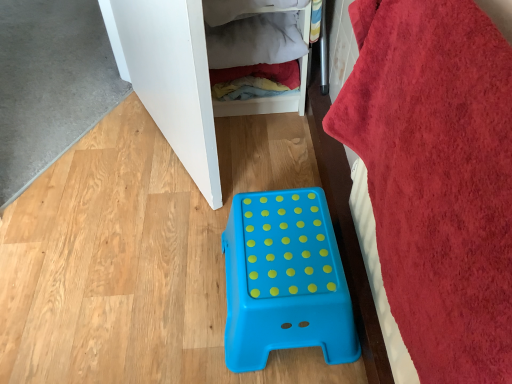
The image size is (512, 384). I want to click on blue plastic step stool at center, the 2th furniture from the left, so click(284, 280).

Describe the element at coordinates (437, 179) in the screenshot. I see `red plush bath towel at right` at that location.

This screenshot has height=384, width=512. What are the coordinates of `wooden/textured clothes at upper center` in the screenshot? It's located at (268, 101).

Where is `bath towel above the wooden/textured clothes at upper center (from a real-world perspective)`? The height and width of the screenshot is (384, 512). bath towel above the wooden/textured clothes at upper center (from a real-world perspective) is located at coordinates (437, 179).

Which of these two, wooden/textured clothes at upper center or red plush bath towel at right, is bigger?

Bigger between the two is red plush bath towel at right.

In the scene shown: From a real-world perspective, which object stands above the other?

red plush bath towel at right.

Is point (287, 99) in front of point (398, 70)?

That is False.

Can you confirm if red plush bath towel at right is bigger than white matte cabinet at upper left, acting as the second furniture starting from the bottom?

No.

Can you confirm if red plush bath towel at right is positioned to the right of white matte cabinet at upper left, acting as the first furniture starting from the top?

Yes.

Measure the distance between red plush bath towel at right and white matte cabinet at upper left, marked as the first furniture in a left-to-right arrangement.

red plush bath towel at right is 23.64 inches away from white matte cabinet at upper left, marked as the first furniture in a left-to-right arrangement.

Which furniture is the 2nd one when counting from the back of the red plush bath towel at right? Please provide its 2D coordinates.

[(180, 80)]

Does white matte cabinet at upper left, acting as the second furniture starting from the bottom, appear on the right side of red plush bath towel at right?

In fact, white matte cabinet at upper left, acting as the second furniture starting from the bottom, is to the left of red plush bath towel at right.

Considering the sizes of objects white matte cabinet at upper left, marked as the first furniture in a left-to-right arrangement, and red plush bath towel at right in the image provided, who is thinner, white matte cabinet at upper left, marked as the first furniture in a left-to-right arrangement, or red plush bath towel at right?

red plush bath towel at right is thinner.

Is white matte cabinet at upper left, marked as the first furniture in a left-to-right arrangement, with red plush bath towel at right?

white matte cabinet at upper left, marked as the first furniture in a left-to-right arrangement, and red plush bath towel at right are clearly separated.

Measure the distance from white matte cabinet at upper left, acting as the first furniture starting from the top, to red plush bath towel at right.

They are 23.64 inches apart.

Based on the photo, does blue plastic step stool at center, the second furniture from the top, turn towards red plush bath towel at right?

No, blue plastic step stool at center, the second furniture from the top, does not turn towards red plush bath towel at right.

In terms of height, does blue plastic step stool at center, the second furniture from the top, look taller or shorter compared to red plush bath towel at right?

blue plastic step stool at center, the second furniture from the top, is shorter than red plush bath towel at right.

From the picture: Looking at the image, does blue plastic step stool at center, the 2th furniture from the left, seem bigger or smaller compared to red plush bath towel at right?

blue plastic step stool at center, the 2th furniture from the left, is smaller than red plush bath towel at right.

Which is more to the left, blue plastic step stool at center, the 1th furniture in the right-to-left sequence, or red plush bath towel at right?

blue plastic step stool at center, the 1th furniture in the right-to-left sequence.

Would you say white matte cabinet at upper left, marked as the first furniture in a left-to-right arrangement, is to the left or to the right of blue plastic step stool at center, the 2th furniture from the left, in the picture?

Based on their positions, white matte cabinet at upper left, marked as the first furniture in a left-to-right arrangement, is located to the left of blue plastic step stool at center, the 2th furniture from the left.

Can you tell me how much white matte cabinet at upper left, acting as the first furniture starting from the top, and blue plastic step stool at center, the 2th furniture from the left, differ in facing direction?

They differ by 23.6 degrees in their facing directions.

Consider the image. Is white matte cabinet at upper left, acting as the first furniture starting from the top, positioned far away from blue plastic step stool at center, the first furniture when ordered from bottom to top?

That's not correct — white matte cabinet at upper left, acting as the first furniture starting from the top, is a little close to blue plastic step stool at center, the first furniture when ordered from bottom to top.

Which point is more forward, [481,90] or [220,113]?

Point [481,90]

Choose the correct answer: Is red plush bath towel at right inside wooden/textured clothes at upper center or outside it?

red plush bath towel at right is spatially situated outside wooden/textured clothes at upper center.

Locate an element on the screen. shelf that is behind the red plush bath towel at right is located at coordinates (268, 101).

Can you confirm if red plush bath towel at right is smaller than wooden/textured clothes at upper center?

No.

Is wooden/textured clothes at upper center oriented towards white matte cabinet at upper left, placed as the second furniture when sorted from right to left?

No, wooden/textured clothes at upper center is not facing towards white matte cabinet at upper left, placed as the second furniture when sorted from right to left.

Which object is thinner, wooden/textured clothes at upper center or white matte cabinet at upper left, placed as the second furniture when sorted from right to left?

white matte cabinet at upper left, placed as the second furniture when sorted from right to left.

Based on the photo, from a real-world perspective, who is located lower, wooden/textured clothes at upper center or white matte cabinet at upper left, acting as the second furniture starting from the bottom?

wooden/textured clothes at upper center.

From the image's perspective, which one is positioned higher, wooden/textured clothes at upper center or white matte cabinet at upper left, acting as the first furniture starting from the top?

wooden/textured clothes at upper center appears higher in the image.

Find the location of a particular element. Image resolution: width=512 pixels, height=384 pixels. shelf that appears behind the red plush bath towel at right is located at coordinates (268, 101).

Identify the location of bath towel located in front of the white matte cabinet at upper left, placed as the second furniture when sorted from right to left. (437, 179).

Which object lies nearer to the anchor point blue plastic step stool at center, the first furniture when ordered from bottom to top, red plush bath towel at right or wooden/textured clothes at upper center?

Among the two, red plush bath towel at right is located nearer to blue plastic step stool at center, the first furniture when ordered from bottom to top.

When comparing their distances from wooden/textured clothes at upper center, does red plush bath towel at right or white matte cabinet at upper left, placed as the second furniture when sorted from right to left, seem closer?

white matte cabinet at upper left, placed as the second furniture when sorted from right to left.

Looking at the image, which one is located further to red plush bath towel at right, white matte cabinet at upper left, acting as the second furniture starting from the bottom, or wooden/textured clothes at upper center?

Among the two, wooden/textured clothes at upper center is located further to red plush bath towel at right.

Estimate the real-world distances between objects in this image. Which object is closer to blue plastic step stool at center, the 2th furniture from the left, white matte cabinet at upper left, acting as the second furniture starting from the bottom, or red plush bath towel at right?

red plush bath towel at right is positioned closer to the anchor blue plastic step stool at center, the 2th furniture from the left.

Considering their positions, is blue plastic step stool at center, the 2th furniture from the left, positioned closer to wooden/textured clothes at upper center than white matte cabinet at upper left, placed as the second furniture when sorted from right to left?

white matte cabinet at upper left, placed as the second furniture when sorted from right to left.

Based on their spatial positions, is wooden/textured clothes at upper center or red plush bath towel at right closer to white matte cabinet at upper left, acting as the second furniture starting from the bottom?

The object closer to white matte cabinet at upper left, acting as the second furniture starting from the bottom, is wooden/textured clothes at upper center.

When comparing their distances from white matte cabinet at upper left, acting as the second furniture starting from the bottom, does blue plastic step stool at center, the 1th furniture in the right-to-left sequence, or wooden/textured clothes at upper center seem closer?

Based on the image, wooden/textured clothes at upper center appears to be nearer to white matte cabinet at upper left, acting as the second furniture starting from the bottom.

Looking at the image, which one is located closer to wooden/textured clothes at upper center, white matte cabinet at upper left, acting as the second furniture starting from the bottom, or red plush bath towel at right?

The object closer to wooden/textured clothes at upper center is white matte cabinet at upper left, acting as the second furniture starting from the bottom.

In order to click on furniture located between red plush bath towel at right and white matte cabinet at upper left, acting as the second furniture starting from the bottom, in the depth direction in this screenshot , I will do `click(284, 280)`.

You are a GUI agent. You are given a task and a screenshot of the screen. Output one action in this format:
    pyautogui.click(x=<x>, y=<y>)
    Task: Click on the furniture between wooden/textured clothes at upper center and blue plastic step stool at center, the second furniture from the top, in the up-down direction
    Image resolution: width=512 pixels, height=384 pixels.
    Given the screenshot: What is the action you would take?
    pyautogui.click(x=180, y=80)